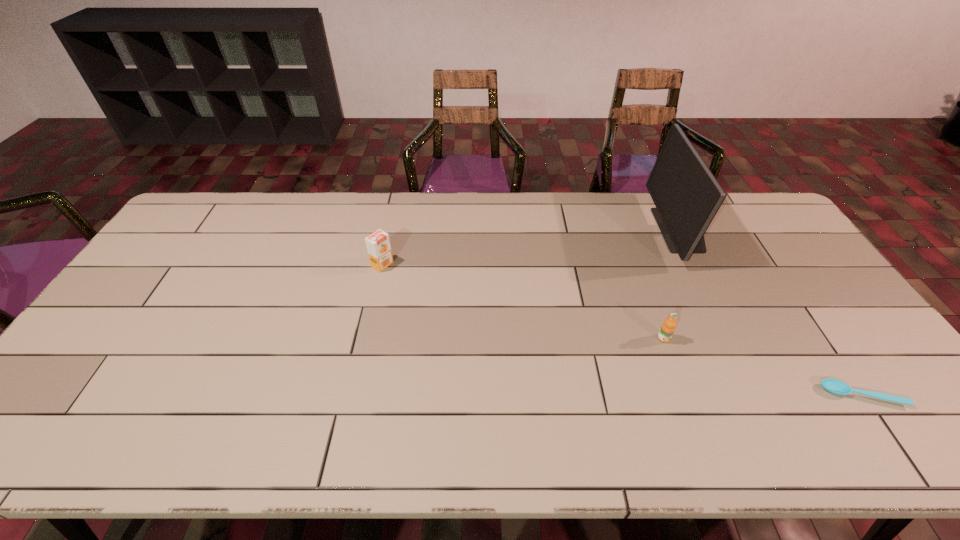
Locate an element on the screen. The image size is (960, 540). vacant space located on the screen side of the second object from right to left is located at coordinates (596, 230).

Locate an element on the screen. The height and width of the screenshot is (540, 960). free spot located on the left of the taller orange juice is located at coordinates (267, 265).

Locate an element on the screen. The width and height of the screenshot is (960, 540). free region located 0.060m on the label of the second shortest object is located at coordinates (672, 362).

What are the coordinates of `vacant area situated on the left of the shortest object` in the screenshot? It's located at (669, 395).

At what (x,y) coordinates should I click in order to perform the action: click on object that is at the far edge. Please return your answer as a coordinate pair (x, y). Looking at the image, I should click on (687, 196).

You are a GUI agent. You are given a task and a screenshot of the screen. Output one action in this format:
    pyautogui.click(x=<x>, y=<y>)
    Task: Click on the object that is at the right edge
    This screenshot has width=960, height=540.
    Given the screenshot: What is the action you would take?
    pyautogui.click(x=835, y=386)

Where is `vacant space at the far edge`? The height and width of the screenshot is (540, 960). vacant space at the far edge is located at coordinates (446, 194).

This screenshot has height=540, width=960. In the image, there is a desktop. What are the coordinates of `vacant space at the near edge` in the screenshot? It's located at (600, 446).

This screenshot has height=540, width=960. I want to click on free space at the left edge of the desktop, so click(137, 326).

Where is `free space at the right edge`? free space at the right edge is located at coordinates 795,305.